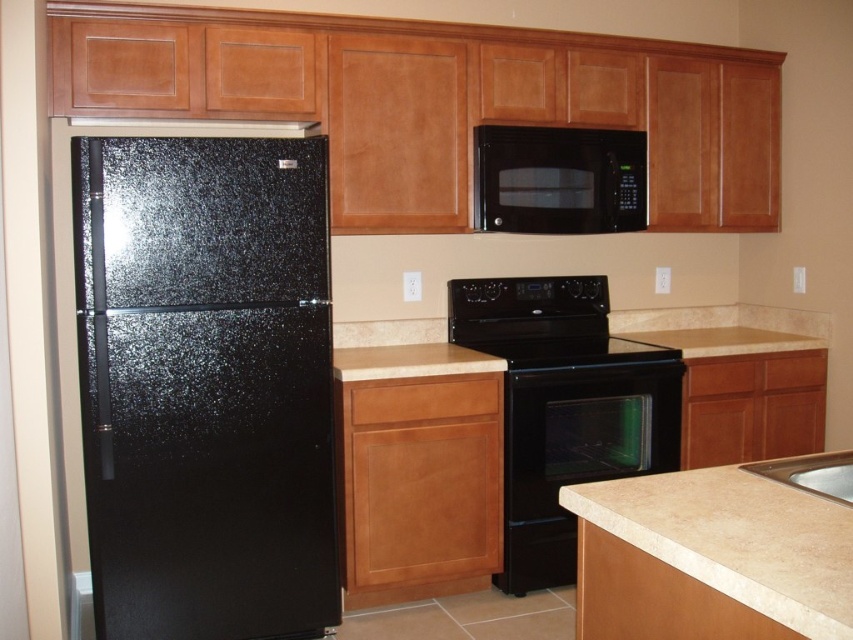
You are planning to move the black speckled refrigerator at left and the black glass oven at center to a new kitchen layout. If you want to place them side by side, which one should you position first to ensure there is enough space?

The black speckled refrigerator at left is bigger than the black glass oven at center, so you should position the black speckled refrigerator at left first to ensure there is enough space.

You are placing a small bowl of lemons on the beige laminate countertop at lower right. Where exactly should you place it to ensure it stays on the countertop?

The beige laminate countertop at lower right is located at point (711, 557), so place the bowl of lemons there to ensure it stays on the countertop.

You are a chef preparing a dish and need to place a hot pan on a surface. You see the beige laminate countertop at lower right and the black glass stove at center. Which surface is suitable for placing the hot pan?

The beige laminate countertop at lower right is located below the black glass stove at center. However, the black glass stove at center is the appropriate surface for placing a hot pan as it is designed for cooking, while the countertop is meant for preparation.